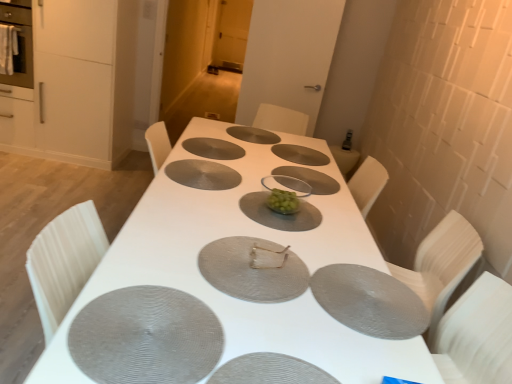
At what (x,y) coordinates should I click in order to perform the action: click on empty space that is in between matte gray pizza pan at center, which appears as the sixth pizza pan when viewed from the front, and green matte platter at center. Please return your answer as a coordinate pair (x, y). The image size is (512, 384). Looking at the image, I should click on (232, 171).